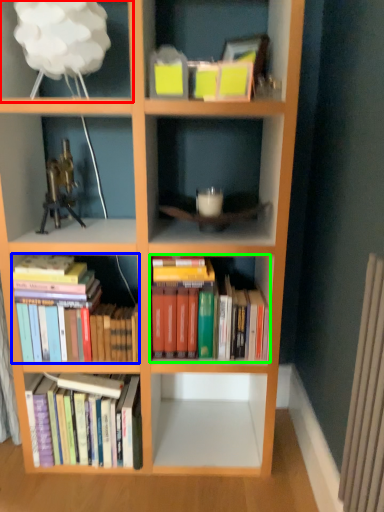
Question: Which object is the farthest from shelf (highlighted by a red box)? Choose among these: book (highlighted by a blue box) or book (highlighted by a green box).

Choices:
 (A) book
 (B) book

Answer: (B)